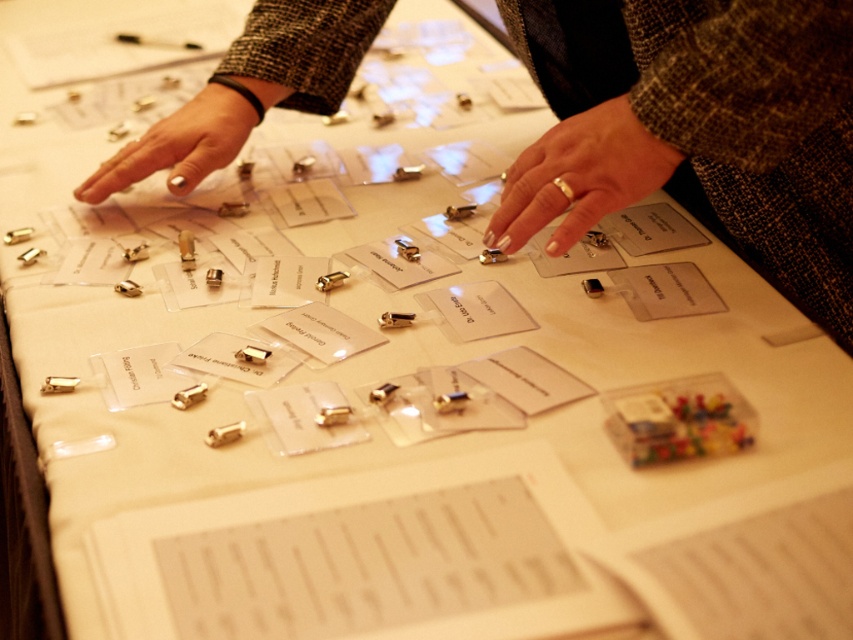
Question: Is silver metallic ring at center below nail polish at center?

Choices:
 (A) no
 (B) yes

Answer: (B)

Question: Which of the following is the farthest from the observer?

Choices:
 (A) nail polish at center
 (B) silver metallic ring at center

Answer: (A)

Question: Does silver metallic ring at center lie in front of nail polish at center?

Choices:
 (A) yes
 (B) no

Answer: (A)

Question: Among these points, which one is nearest to the camera?

Choices:
 (A) (239, 132)
 (B) (566, 216)

Answer: (B)

Question: Is silver metallic ring at center to the left of nail polish at center from the viewer's perspective?

Choices:
 (A) yes
 (B) no

Answer: (B)